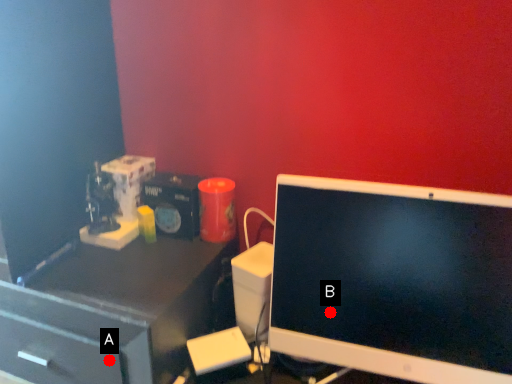
Question: Two points are circled on the image, labeled by A and B beside each circle. Which point appears closest to the camera in this image?

Choices:
 (A) A is closer
 (B) B is closer

Answer: (B)